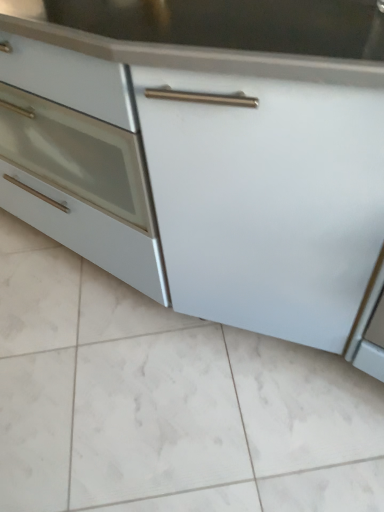
Locate an element on the screen. white matte cabinet at center is located at coordinates (210, 156).

This screenshot has height=512, width=384. What do you see at coordinates (210, 156) in the screenshot?
I see `white matte cabinet at center` at bounding box center [210, 156].

Find the location of `white matte cabinet at center`. white matte cabinet at center is located at coordinates (210, 156).